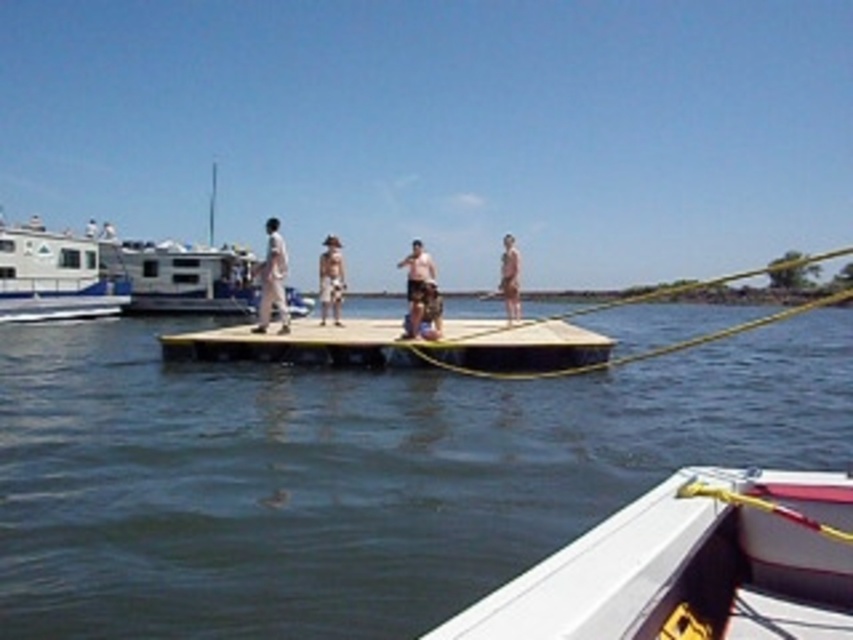
Question: Where is white plastic boat at left located in relation to tan skin man at center in the image?

Choices:
 (A) below
 (B) above

Answer: (B)

Question: Which point appears closest to the camera in this image?

Choices:
 (A) (845, 444)
 (B) (432, 321)
 (C) (33, 269)
 (D) (279, 240)

Answer: (A)

Question: Considering the real-world distances, which object is farthest from the brown wooden dock at center?

Choices:
 (A) beige fabric hat at center
 (B) white matte pants at center
 (C) dark blue water at center
 (D) white plastic boat at left

Answer: (D)

Question: Which of the following is the closest to the observer?

Choices:
 (A) (256, 326)
 (B) (329, 248)
 (C) (415, 250)

Answer: (C)

Question: Can you confirm if white plastic boat at left is positioned to the right of white matte pants at center?

Choices:
 (A) no
 (B) yes

Answer: (A)

Question: Does brown wooden dock at center have a larger size compared to white matte pants at center?

Choices:
 (A) no
 (B) yes

Answer: (B)